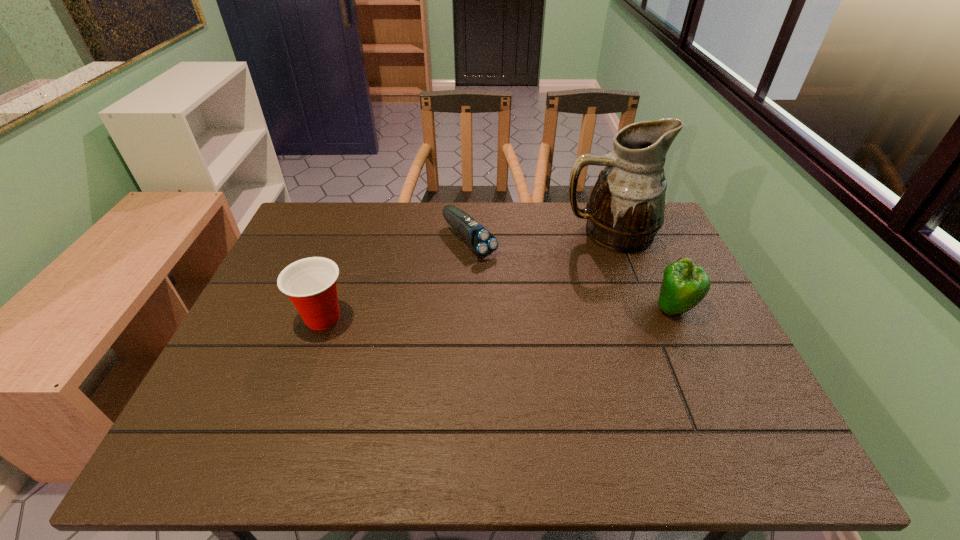
At what (x,y) coordinates should I click in order to perform the action: click on free region located on the head of the electric shaver. Please return your answer as a coordinate pair (x, y). The image size is (960, 540). Looking at the image, I should click on (516, 286).

Locate an element on the screen. Image resolution: width=960 pixels, height=540 pixels. vacant region located from the spout of the pitcher is located at coordinates (549, 264).

I want to click on vacant space situated 0.100m from the spout of the pitcher, so click(554, 261).

Identify the location of vacant space located 0.060m from the spout of the pitcher. (563, 255).

The height and width of the screenshot is (540, 960). I want to click on electric shaver at the far edge, so click(481, 241).

I want to click on pitcher that is positioned at the far edge, so click(x=625, y=210).

In order to click on object that is positioned at the left edge in this screenshot , I will do `click(311, 283)`.

Identify the location of bell pepper present at the right edge. (685, 285).

I want to click on pitcher that is at the right edge, so click(x=625, y=210).

Where is `object that is at the far right corner`? Image resolution: width=960 pixels, height=540 pixels. object that is at the far right corner is located at coordinates [x=625, y=210].